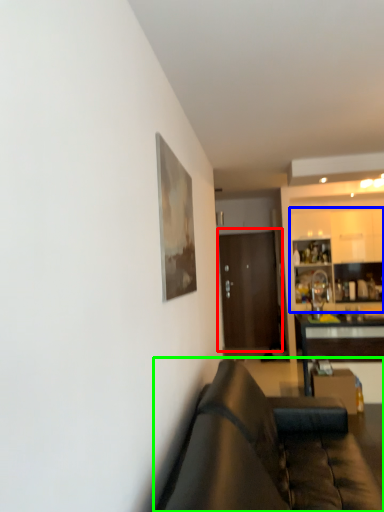
Question: Which object is the closest to the door (highlighted by a red box)? Choose among these: cabinetry (highlighted by a blue box) or studio couch (highlighted by a green box).

Choices:
 (A) cabinetry
 (B) studio couch

Answer: (A)